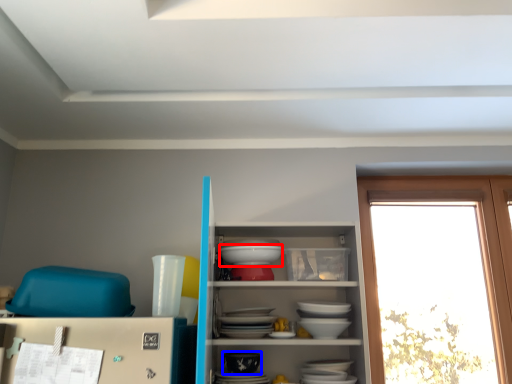
Question: Which point is closer to the camera, table (highlighted by a red box) or tableware (highlighted by a blue box)?

Choices:
 (A) table
 (B) tableware

Answer: (B)